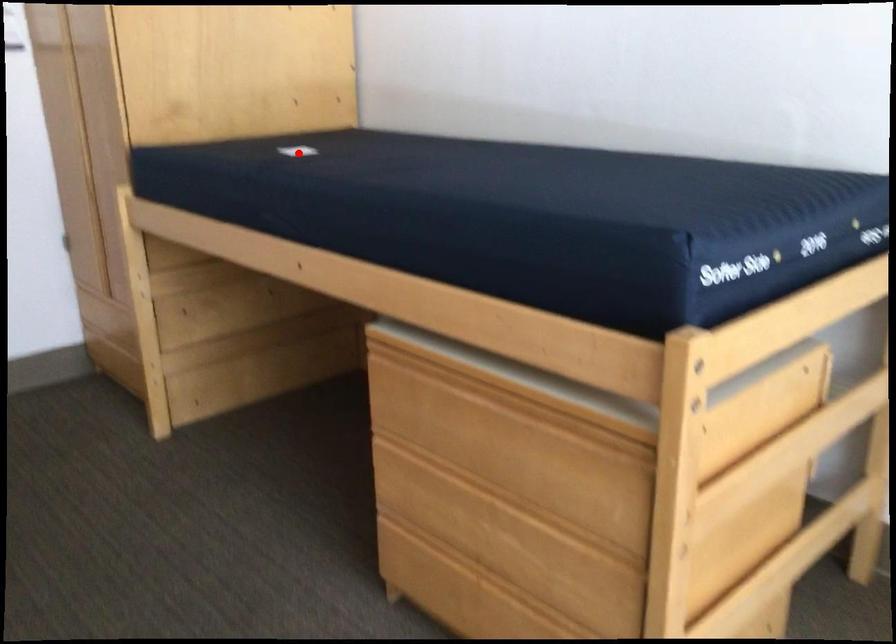
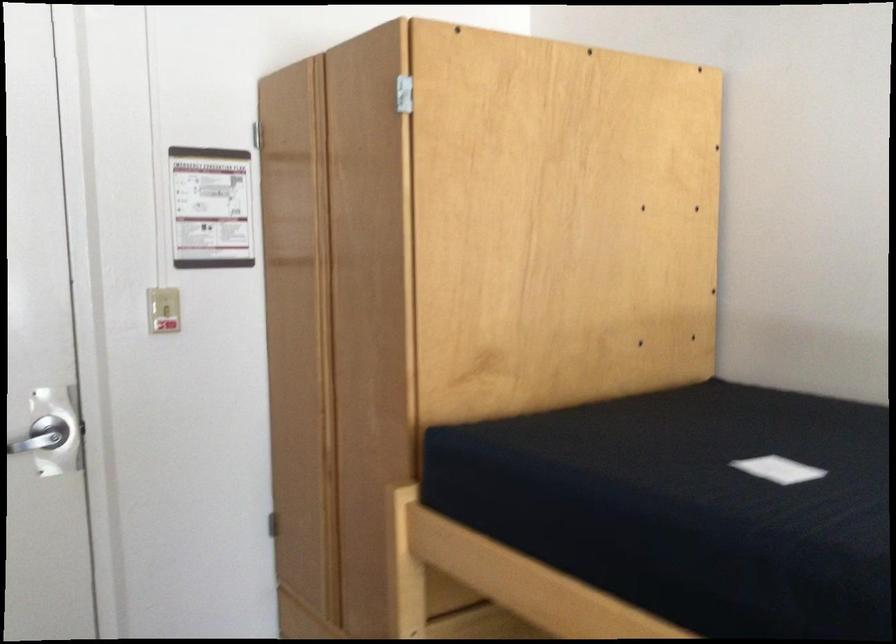
In the second image, find the point that corresponds to the highlighted location in the first image.

(778, 469)